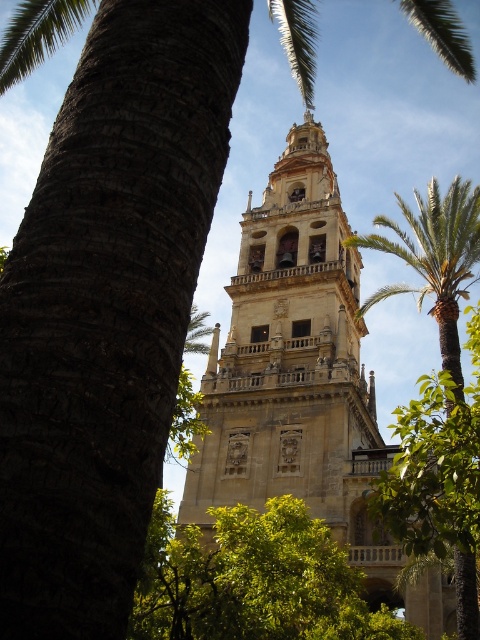
You are standing at point (300, 378) in the image. What structure is directly in front of you?

The beige stone tower at center is directly in front of you at point (300, 378).

Looking at this image, you are standing in a plaza and see the beige stone tower at center and the green leafy tree at center. Which object takes up more space in the image?

The beige stone tower at center is bigger than the green leafy tree at center, so it takes up more space in the image.

Looking at this image, you are standing in front of the historic bell tower and want to determine the relative positions of two points marked on the tower. Which of the two points, point (299, 506) or point (409, 218), is closer to you?

Point (299, 506) is closer to the viewer than point (409, 218).